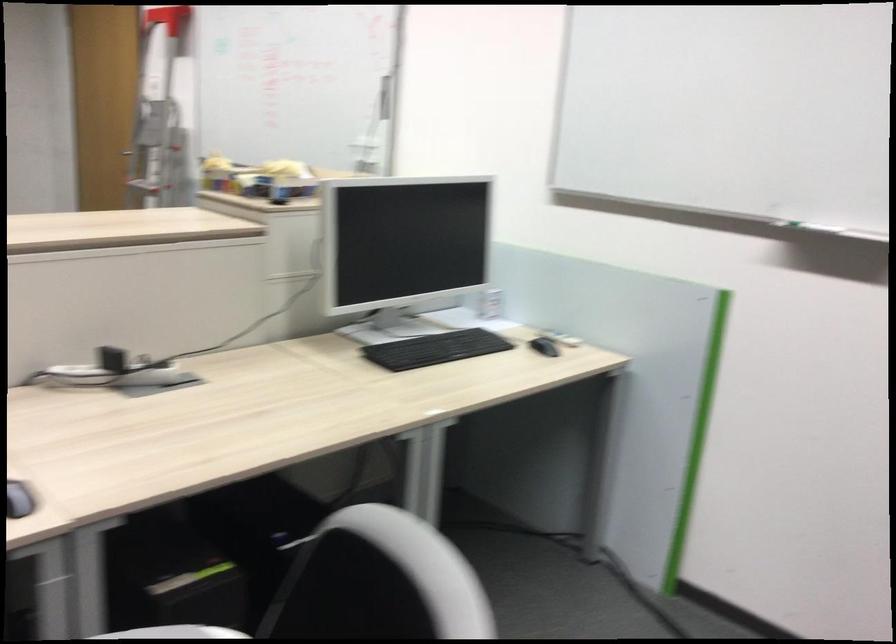
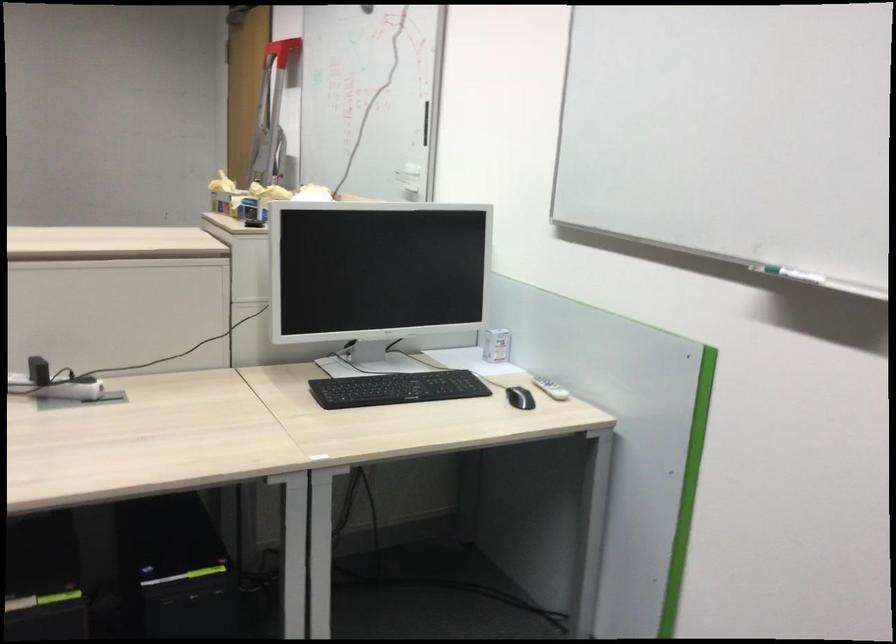
Find the pixel in the second image that matches (563,339) in the first image.

(550, 388)